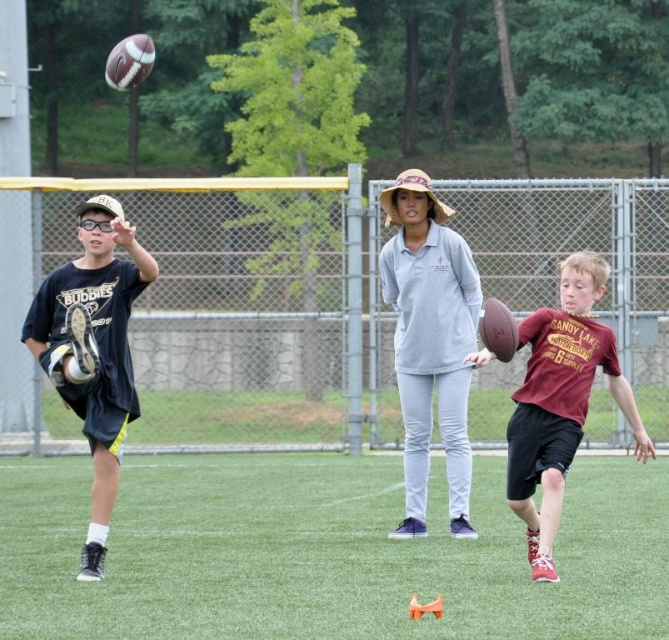
Question: Based on their relative distances, which object is nearer to the black matte t-shirt at left?

Choices:
 (A) maroon jersey at right
 (B) green artificial turf at center

Answer: (A)

Question: Does gray cotton shirt at center appear on the right side of maroon jersey at right?

Choices:
 (A) no
 (B) yes

Answer: (A)

Question: Which object is closer to the camera taking this photo?

Choices:
 (A) maroon jersey at right
 (B) black matte t-shirt at left
 (C) green artificial turf at center
 (D) gray cotton shirt at center

Answer: (A)

Question: Which object appears closest to the camera in this image?

Choices:
 (A) gray cotton shirt at center
 (B) green artificial turf at center
 (C) maroon jersey at right
 (D) black matte t-shirt at left

Answer: (C)

Question: Is green artificial turf at center below black matte t-shirt at left?

Choices:
 (A) yes
 (B) no

Answer: (A)

Question: Is green artificial turf at center bigger than maroon jersey at right?

Choices:
 (A) yes
 (B) no

Answer: (B)